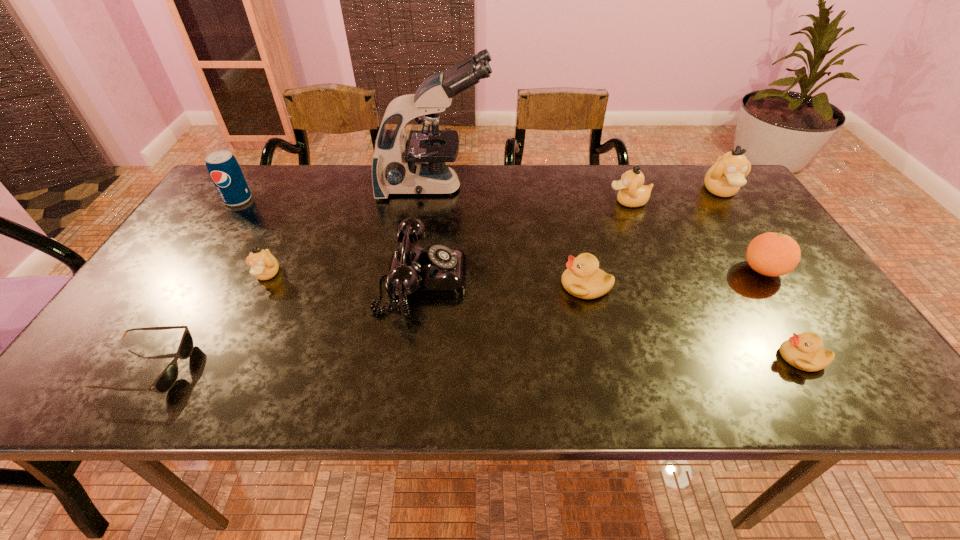
Identify which tan duckling is the third closest to the right yellow duckling. Please provide its 2D coordinates. Your answer should be formatted as a tuple, i.e. [(x, y)], where the tuple contains the x and y coordinates of a point satisfying the conditions above.

[(264, 266)]

Locate an element on the screen. This screenshot has height=540, width=960. vacant region that satisfies the following two spatial constraints: 1. on the face of the rightmost tan duckling; 2. on the front-facing side of the bigger yellow duckling is located at coordinates (784, 286).

Identify the location of vacant space that satisfies the following two spatial constraints: 1. on the face of the tallest duckling; 2. on the lenses of the shortest object. The image size is (960, 540). (840, 368).

I want to click on free space in the image that satisfies the following two spatial constraints: 1. on the face of the tallest duckling; 2. on the front-facing side of the left yellow duckling, so click(784, 286).

This screenshot has width=960, height=540. Identify the location of vacant area in the image that satisfies the following two spatial constraints: 1. on the face of the third duckling from right to left; 2. on the face of the leftmost duckling. (658, 275).